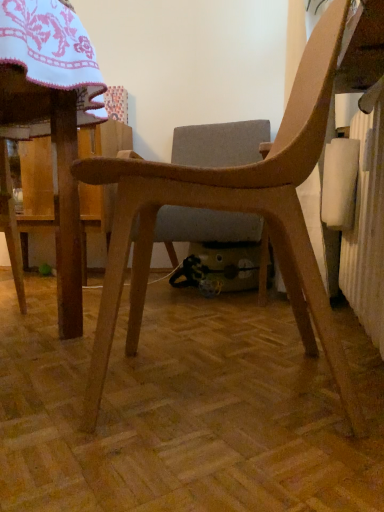
Identify the location of free spot below wooden chair at center (from a real-world perspective). The width and height of the screenshot is (384, 512). (x=228, y=384).